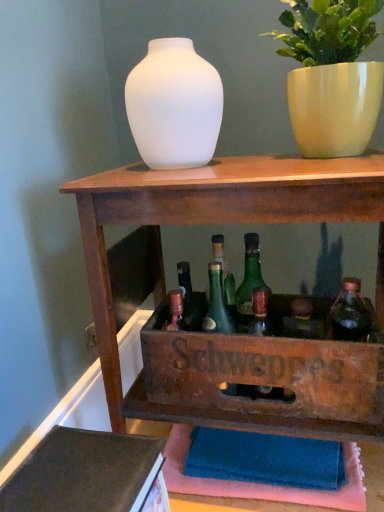
At what (x,y) coordinates should I click in order to perform the action: click on translucent glass bottle at center-right, which is the first bottle from right to left. Please return your answer as a coordinate pair (x, y). The width and height of the screenshot is (384, 512). Looking at the image, I should click on (350, 313).

Measure the distance between frosted glass vase at center and camera.

30.76 inches.

What do you see at coordinates (174, 106) in the screenshot? I see `frosted glass vase at center` at bounding box center [174, 106].

Locate an element on the screen. white glossy pot at upper right is located at coordinates (332, 75).

Is white glossy pot at upper right smaller than green glass bottle at center?

Actually, white glossy pot at upper right might be larger than green glass bottle at center.

Between white glossy pot at upper right and green glass bottle at center, which one appears on the right side from the viewer's perspective?

white glossy pot at upper right is more to the right.

This screenshot has width=384, height=512. What are the coordinates of `houseplant located on the right of green glass bottle at center` in the screenshot? It's located at (332, 75).

From a real-world perspective, which object stands above the other?

white glossy pot at upper right, from a real-world perspective.

Can we say green glass bottle at center lies outside green glass bottle at center, the first bottle in the left-to-right sequence?

Yes, green glass bottle at center is outside of green glass bottle at center, the first bottle in the left-to-right sequence.

Considering the sizes of objects green glass bottle at center and green glass bottle at center, the first bottle in the left-to-right sequence, in the image provided, who is smaller, green glass bottle at center or green glass bottle at center, the first bottle in the left-to-right sequence,?

With smaller size is green glass bottle at center, the first bottle in the left-to-right sequence.

Is green glass bottle at center looking in the opposite direction of green glass bottle at center, the 2th bottle positioned from the right?

Absolutely, green glass bottle at center is directed away from green glass bottle at center, the 2th bottle positioned from the right.

Would you say wooden shelf at center is outside frosted glass vase at center?

wooden shelf at center lies outside frosted glass vase at center's area.

From a real-world perspective, between wooden shelf at center and frosted glass vase at center, who is vertically lower?

wooden shelf at center, from a real-world perspective.

Considering the positions of objects wooden shelf at center and frosted glass vase at center in the image provided, who is more to the right, wooden shelf at center or frosted glass vase at center?

wooden shelf at center.

From the image's perspective, which one is positioned lower, wooden shelf at center or frosted glass vase at center?

From the image's view, wooden shelf at center is below.

Is green glass bottle at center at the right side of translucent glass bottle at center-right, which is the first bottle from right to left?

In fact, green glass bottle at center is to the left of translucent glass bottle at center-right, which is the first bottle from right to left.

Does green glass bottle at center contain translucent glass bottle at center-right, which is the first bottle from right to left?

No, translucent glass bottle at center-right, which is the first bottle from right to left, is not a part of green glass bottle at center.

Is green glass bottle at center positioned with its back to translucent glass bottle at center-right, which is the first bottle from right to left?

No, green glass bottle at center is not facing the opposite direction of translucent glass bottle at center-right, which is the first bottle from right to left.

From the image's perspective, between green glass bottle at center, the 2th bottle positioned from the right, and white glossy pot at upper right, which one is located above?

white glossy pot at upper right appears higher in the image.

Considering the sizes of objects green glass bottle at center, the 2th bottle positioned from the right, and white glossy pot at upper right in the image provided, who is smaller, green glass bottle at center, the 2th bottle positioned from the right, or white glossy pot at upper right?

With smaller size is green glass bottle at center, the 2th bottle positioned from the right.

Identify the location of houseplant lying in front of the green glass bottle at center, the first bottle in the left-to-right sequence. The height and width of the screenshot is (512, 384). click(x=332, y=75).

Looking at this image, is green glass bottle at center, the 2th bottle positioned from the right, facing away from white glossy pot at upper right?

green glass bottle at center, the 2th bottle positioned from the right, does not have its back to white glossy pot at upper right.

Considering the relative positions of frosted glass vase at center and white glossy pot at upper right in the image provided, is frosted glass vase at center to the left or to the right of white glossy pot at upper right?

Clearly, frosted glass vase at center is on the left of white glossy pot at upper right in the image.

This screenshot has width=384, height=512. I want to click on vase that is behind the white glossy pot at upper right, so click(174, 106).

Does frosted glass vase at center lie behind white glossy pot at upper right?

Yes, it is behind white glossy pot at upper right.

Is frosted glass vase at center shorter than white glossy pot at upper right?

Yes, frosted glass vase at center is shorter than white glossy pot at upper right.

Is green glass bottle at center at the back of green glass bottle at center, the 2th bottle positioned from the right?

Yes, green glass bottle at center, the 2th bottle positioned from the right,'s orientation is away from green glass bottle at center.

Where is `glass bottle that is above the green glass bottle at center, the 2th bottle positioned from the right (from the image's perspective)`? glass bottle that is above the green glass bottle at center, the 2th bottle positioned from the right (from the image's perspective) is located at coordinates (249, 282).

Is green glass bottle at center, the 2th bottle positioned from the right, placed right next to green glass bottle at center?

Yes, green glass bottle at center, the 2th bottle positioned from the right, is touching green glass bottle at center.

Considering the relative positions of green glass bottle at center, the 2th bottle positioned from the right, and green glass bottle at center in the image provided, is green glass bottle at center, the 2th bottle positioned from the right, to the left of green glass bottle at center from the viewer's perspective?

Correct, you'll find green glass bottle at center, the 2th bottle positioned from the right, to the left of green glass bottle at center.

In order to click on glass bottle that is on the left side of white glossy pot at upper right in this screenshot , I will do `click(249, 282)`.

At what (x,y) coordinates should I click in order to perform the action: click on glass bottle that is above the green glass bottle at center, the 2th bottle positioned from the right (from the image's perspective). Please return your answer as a coordinate pair (x, y). This screenshot has width=384, height=512. Looking at the image, I should click on (249, 282).

When comparing their distances from green glass bottle at center, the first bottle in the left-to-right sequence, does frosted glass vase at center or white glossy pot at upper right seem closer?

The object closer to green glass bottle at center, the first bottle in the left-to-right sequence, is frosted glass vase at center.

Estimate the real-world distances between objects in this image. Which object is closer to translucent glass bottle at center-right, the second bottle viewed from the left, wooden shelf at center or white glossy pot at upper right?

wooden shelf at center is positioned closer to the anchor translucent glass bottle at center-right, the second bottle viewed from the left.

Based on their spatial positions, is wooden shelf at center or white glossy pot at upper right further from green glass bottle at center?

white glossy pot at upper right lies further to green glass bottle at center than the other object.

Which object lies further to the anchor point green glass bottle at center, white glossy pot at upper right or translucent glass bottle at center-right, the second bottle viewed from the left?

white glossy pot at upper right is positioned further to the anchor green glass bottle at center.

Considering their positions, is white glossy pot at upper right positioned further to frosted glass vase at center than green glass bottle at center, the 2th bottle positioned from the right?

green glass bottle at center, the 2th bottle positioned from the right, is further to frosted glass vase at center.

Based on their spatial positions, is frosted glass vase at center or green glass bottle at center, the 2th bottle positioned from the right, closer to translucent glass bottle at center-right, which is the first bottle from right to left?

Among the two, green glass bottle at center, the 2th bottle positioned from the right, is located nearer to translucent glass bottle at center-right, which is the first bottle from right to left.

When comparing their distances from frosted glass vase at center, does translucent glass bottle at center-right, the second bottle viewed from the left, or green glass bottle at center, the first bottle in the left-to-right sequence, seem further?

Among the two, translucent glass bottle at center-right, the second bottle viewed from the left, is located further to frosted glass vase at center.

Based on their spatial positions, is green glass bottle at center or translucent glass bottle at center-right, which is the first bottle from right to left, further from frosted glass vase at center?

Based on the image, translucent glass bottle at center-right, which is the first bottle from right to left, appears to be further to frosted glass vase at center.

Where is `glass bottle between white glossy pot at upper right and wooden shelf at center vertically`? glass bottle between white glossy pot at upper right and wooden shelf at center vertically is located at coordinates (249, 282).

This screenshot has height=512, width=384. Identify the location of shelf between white glossy pot at upper right and green glass bottle at center, the 2th bottle positioned from the right, vertically. (240, 335).

The image size is (384, 512). I want to click on vase between white glossy pot at upper right and green glass bottle at center, the first bottle in the left-to-right sequence, from top to bottom, so click(174, 106).

The width and height of the screenshot is (384, 512). In order to click on vase between white glossy pot at upper right and wooden shelf at center vertically in this screenshot , I will do `click(174, 106)`.